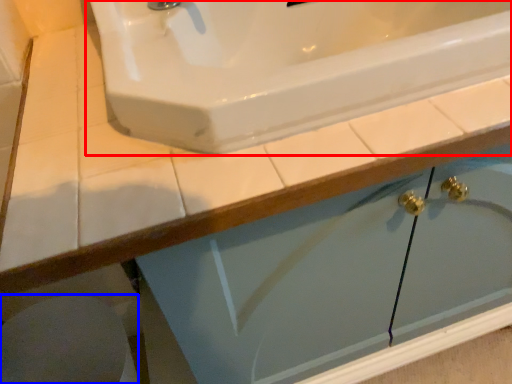
Question: Which of the following is the farthest to the observer, sink (highlighted by a red box) or porcelain (highlighted by a blue box)?

Choices:
 (A) sink
 (B) porcelain

Answer: (B)